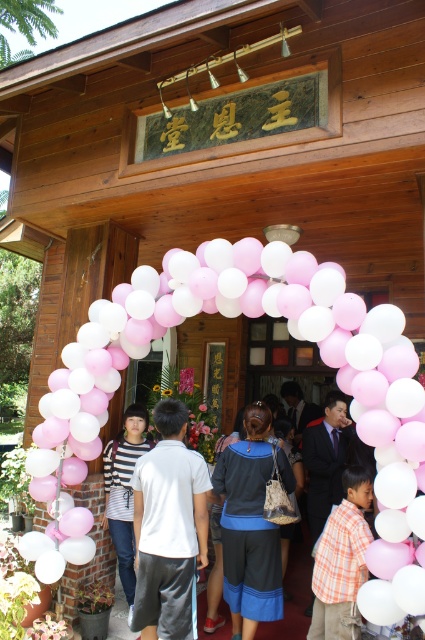
You are standing in front of the wooden building and want to take a photo of the pink matte balloons at center. Where should you position yourself to capture them in the frame?

You should position yourself directly in front of the wooden building, as the pink matte balloons at center are located at point (300, 332), which is centrally positioned in the scene.

You are standing in front of the building and want to take a photo of the striped fabric shirt at center without the pink matte balloons at center blocking the view. Is this possible?

The pink matte balloons at center are in front of the striped fabric shirt at center, so they would block the view. To take a photo of the striped fabric shirt at center without the balloons, you would need to move the balloons or reposition yourself so the balloons are not between you and the shirt.

You are standing in front of the festive wooden building and see both the pink matte balloons at center and the orange plaid shirt at center. Which object is positioned more to the left?

The pink matte balloons at center are positioned more to the left than the orange plaid shirt at center.